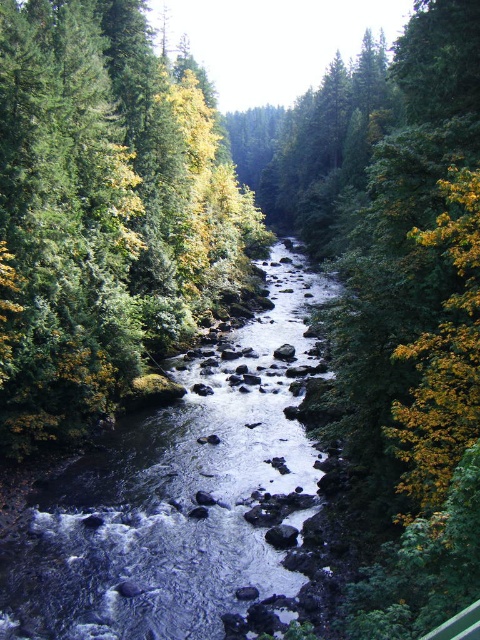
Question: Among these objects, which one is nearest to the camera?

Choices:
 (A) clear water at center
 (B) green matte tree at center

Answer: (A)

Question: Among these objects, which one is nearest to the camera?

Choices:
 (A) clear water at center
 (B) green matte tree at center

Answer: (A)

Question: Can you confirm if green matte tree at center is positioned to the right of clear water at center?

Choices:
 (A) yes
 (B) no

Answer: (B)

Question: Does green matte tree at center appear over clear water at center?

Choices:
 (A) no
 (B) yes

Answer: (B)

Question: Can you confirm if green matte tree at center is smaller than clear water at center?

Choices:
 (A) no
 (B) yes

Answer: (A)